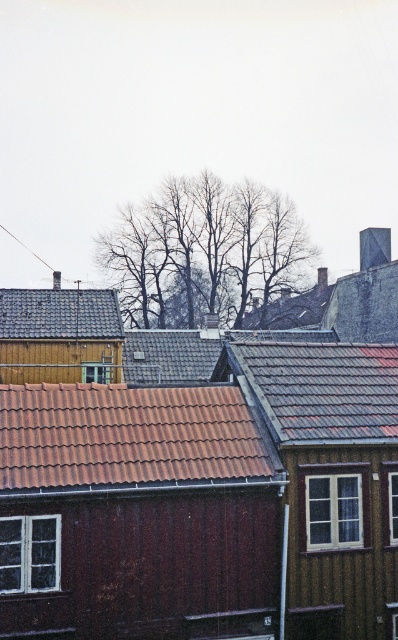
Can you confirm if gray tile roof at center is taller than gray slate roof at upper left?

In fact, gray tile roof at center may be shorter than gray slate roof at upper left.

Who is more distant from viewer, (284,438) or (13,304)?

Point (13,304)

This screenshot has height=640, width=398. Find the location of `gray tile roof at center`. gray tile roof at center is located at coordinates (321, 388).

Is brown tile roof at center above gray tile roof at center?

Actually, brown tile roof at center is below gray tile roof at center.

Between point (259, 456) and point (277, 417), which one is positioned in front?

Point (259, 456) is in front.

Who is more forward, [230,403] or [306,422]?

Point [306,422] is in front.

Find the location of `brown tile roof at center`. brown tile roof at center is located at coordinates (126, 435).

Does brown tile roof at center appear over gray slate roof at upper left?

Incorrect, brown tile roof at center is not positioned above gray slate roof at upper left.

In the scene shown: Can you confirm if brown tile roof at center is positioned below gray slate roof at upper left?

Indeed, brown tile roof at center is positioned under gray slate roof at upper left.

Which is behind, point (93, 401) or point (66, 323)?

Point (66, 323)

The width and height of the screenshot is (398, 640). Identify the location of brown tile roof at center. (126, 435).